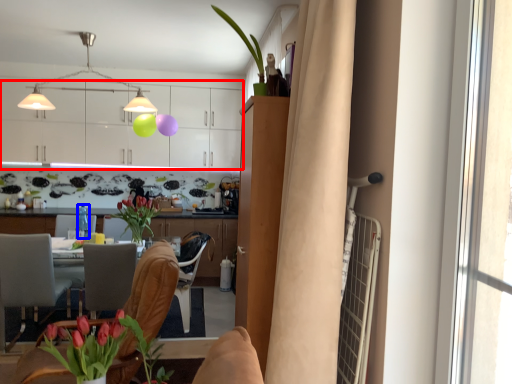
Question: Which object appears closest to the camera in this image, cabinetry (highlighted by a red box) or bottle (highlighted by a blue box)?

Choices:
 (A) cabinetry
 (B) bottle

Answer: (B)